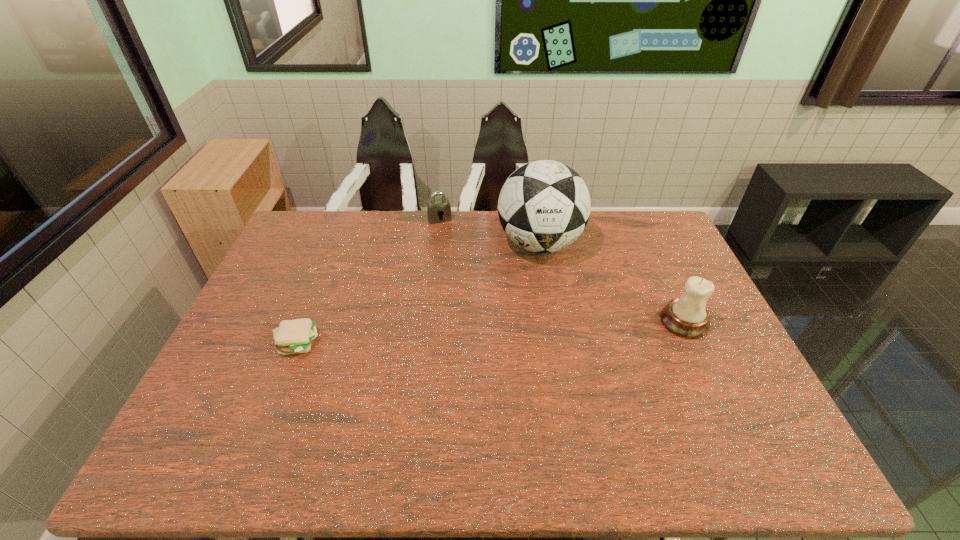
I want to click on vacant spot on the desktop that is between the leftmost object and the rightmost object and is positioned on the surface of the soccer ball where the brand logo is visible, so click(445, 335).

Find the location of a particular element. The image size is (960, 540). free space on the desktop that is between the leftmost object and the rightmost object and is positioned at the front of the second shortest object near the keyhole is located at coordinates (490, 332).